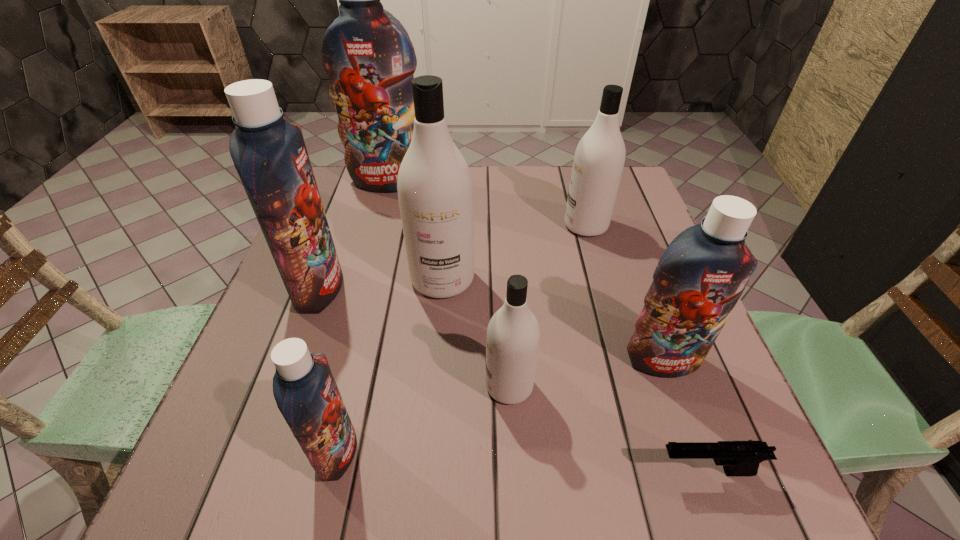
Locate an element on the screen. The width and height of the screenshot is (960, 540). vacant area between the rightmost blue shampoo and the fifth object from left to right is located at coordinates (586, 373).

This screenshot has height=540, width=960. What are the coordinates of `vacant area between the pistol and the farthest shampoo` in the screenshot? It's located at (547, 327).

Where is `free area in between the tallest shampoo and the rightmost blue shampoo`? free area in between the tallest shampoo and the rightmost blue shampoo is located at coordinates (526, 271).

At what (x,y) coordinates should I click in order to perform the action: click on free spot between the smallest blue shampoo and the leftmost white shampoo. Please return your answer as a coordinate pair (x, y). Image resolution: width=960 pixels, height=540 pixels. Looking at the image, I should click on (390, 365).

The width and height of the screenshot is (960, 540). I want to click on vacant space that is in between the rightmost blue shampoo and the leftmost white shampoo, so click(553, 320).

Where is `vacant area that lies between the tallest shampoo and the smallest blue shampoo`? The height and width of the screenshot is (540, 960). vacant area that lies between the tallest shampoo and the smallest blue shampoo is located at coordinates (363, 316).

Where is `object that ranks as the second closest to the biggest blue shampoo`? The image size is (960, 540). object that ranks as the second closest to the biggest blue shampoo is located at coordinates (269, 154).

Where is `the third closest object to the leftmost white shampoo`? the third closest object to the leftmost white shampoo is located at coordinates (599, 158).

Point out which shampoo is positioned as the fifth nearest to the second white shampoo from right to left. Please provide its 2D coordinates. Your answer should be formatted as a tuple, i.e. [(x, y)], where the tuple contains the x and y coordinates of a point satisfying the conditions above.

[(599, 158)]

The width and height of the screenshot is (960, 540). Find the location of `shampoo that stands as the seventh closest to the black pistol`. shampoo that stands as the seventh closest to the black pistol is located at coordinates (366, 52).